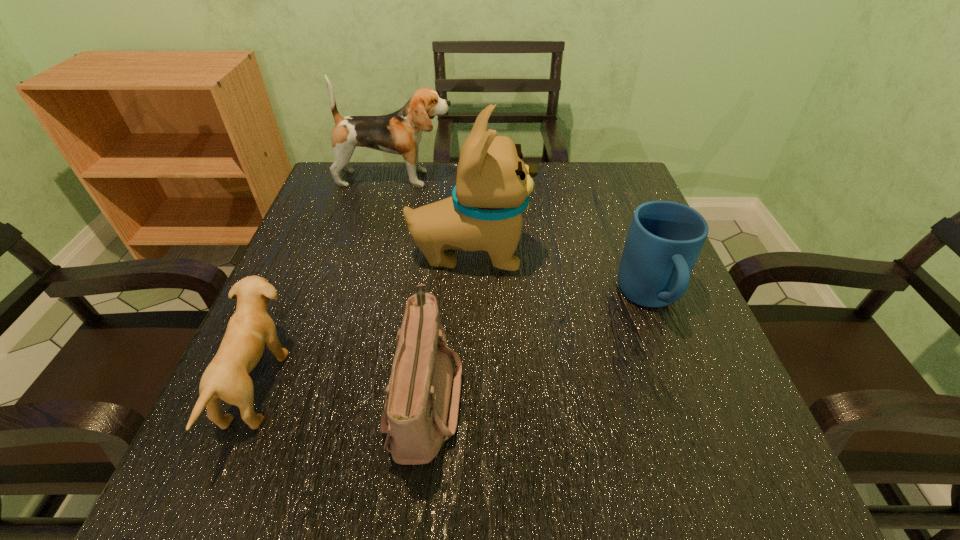
This screenshot has width=960, height=540. In order to click on vacant space that satisfies the following two spatial constraints: 1. on the side of the mug with the handle; 2. on the front pocket of the shoulder bag in this screenshot , I will do `click(687, 397)`.